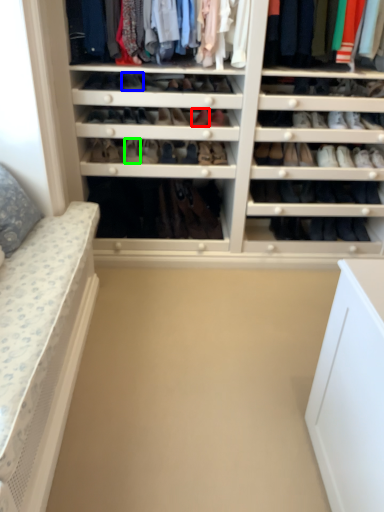
Question: Which object is the closest to the shoe (highlighted by a red box)? Choose among these: shoe (highlighted by a blue box) or shoe (highlighted by a green box).

Choices:
 (A) shoe
 (B) shoe

Answer: (A)